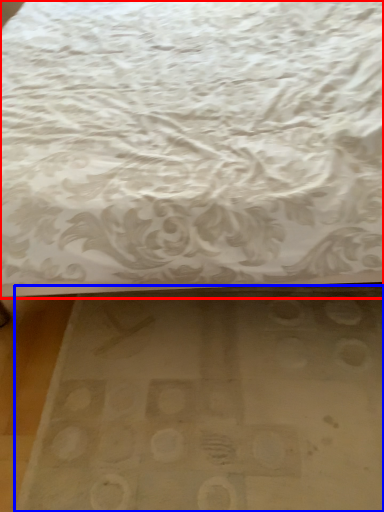
Question: Which of the following is the farthest to the observer, bed (highlighted by a red box) or mat (highlighted by a blue box)?

Choices:
 (A) bed
 (B) mat

Answer: (B)